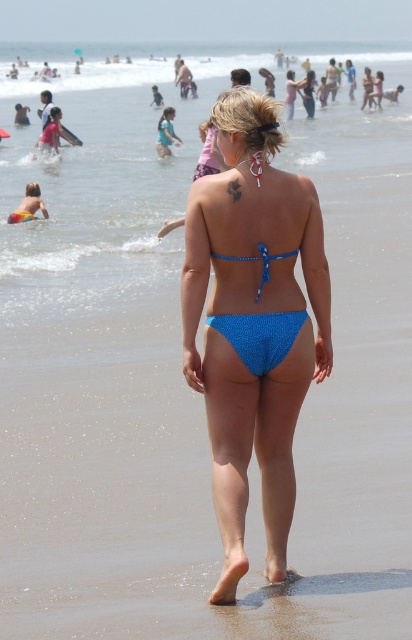
Does matte pink swimsuit at upper left appear on the right side of light blue fabric bikini top at upper center?

No, matte pink swimsuit at upper left is not to the right of light blue fabric bikini top at upper center.

Who is more distant from viewer, (x=51, y=148) or (x=177, y=136)?

Point (x=177, y=136)

Find the location of a particular element. matte pink swimsuit at upper left is located at coordinates (51, 131).

Is blue fabric bikini at center thinner than blue glittery bikini bottom at center?

In fact, blue fabric bikini at center might be wider than blue glittery bikini bottom at center.

Who is more distant from viewer, (280, 448) or (267, 336)?

The point (280, 448) is more distant.

Image resolution: width=412 pixels, height=640 pixels. What are the coordinates of `blue fabric bikini at center` in the screenshot? It's located at (252, 320).

Consider the image. Can you confirm if blue glittery bikini bottom at center is shorter than matte pink swimsuit at upper left?

Yes.

Which is behind, point (236, 259) or point (58, 140)?

The point (58, 140) is behind.

You are a GUI agent. You are given a task and a screenshot of the screen. Output one action in this format:
    pyautogui.click(x=<x>, y=<y>)
    Task: Click on the blue glittery bikini bottom at center
    This screenshot has width=412, height=640.
    Given the screenshot: What is the action you would take?
    pyautogui.click(x=259, y=336)